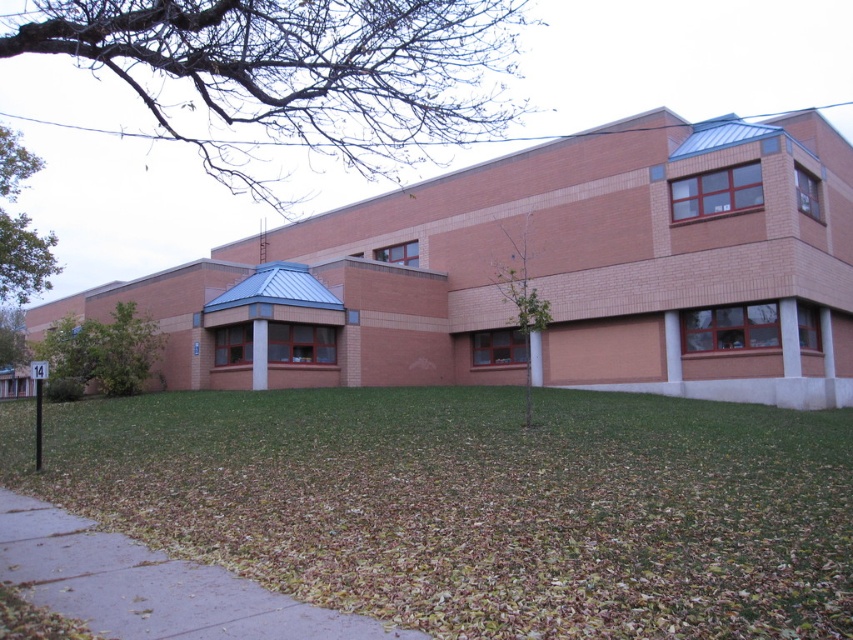
Question: Does green grass at lower center come in front of brown concrete sidewalk at lower left?

Choices:
 (A) yes
 (B) no

Answer: (A)

Question: Does green grass at lower center have a greater width compared to brown concrete sidewalk at lower left?

Choices:
 (A) yes
 (B) no

Answer: (A)

Question: Which point is closer to the camera taking this photo?

Choices:
 (A) (585, 544)
 (B) (140, 547)

Answer: (A)

Question: Is green grass at lower center bigger than brown concrete sidewalk at lower left?

Choices:
 (A) no
 (B) yes

Answer: (B)

Question: Among these objects, which one is farthest from the camera?

Choices:
 (A) brown concrete sidewalk at lower left
 (B) green grass at lower center

Answer: (A)

Question: Which object appears farthest from the camera in this image?

Choices:
 (A) brown concrete sidewalk at lower left
 (B) green grass at lower center

Answer: (A)